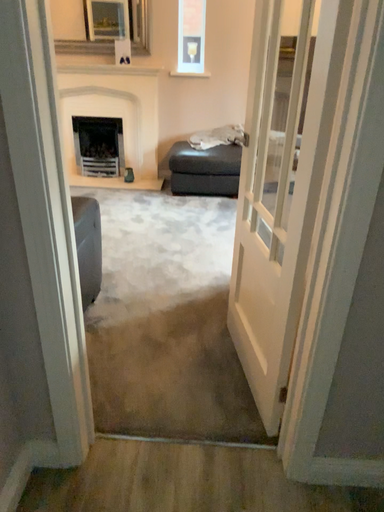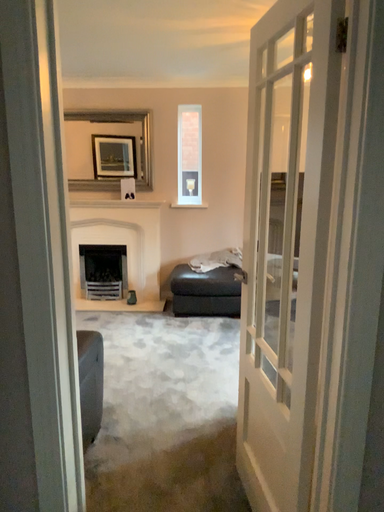
Question: Which way did the camera rotate in the video?

Choices:
 (A) rotated upward
 (B) rotated downward

Answer: (A)